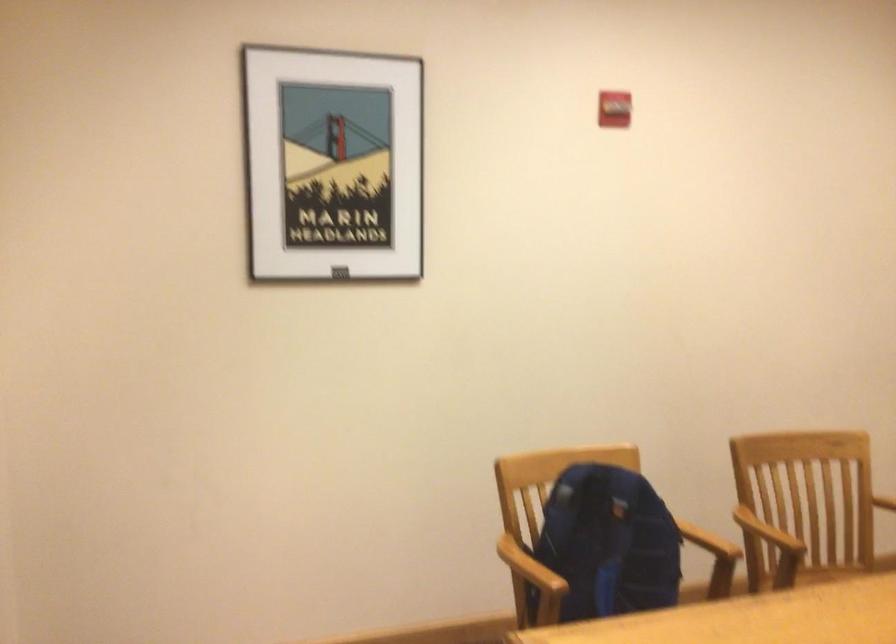
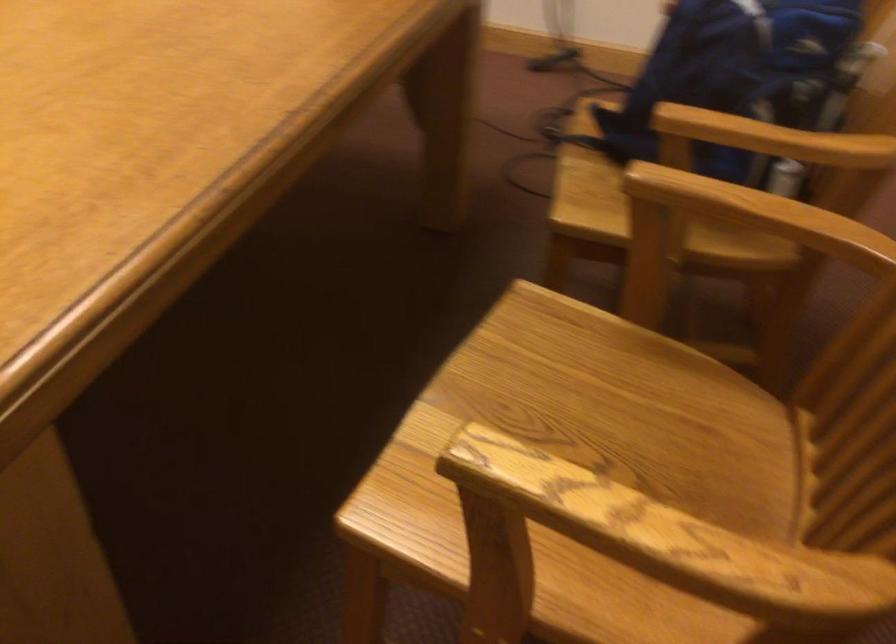
Find the pixel in the second image that matches point 756,543 in the first image.

(743, 223)